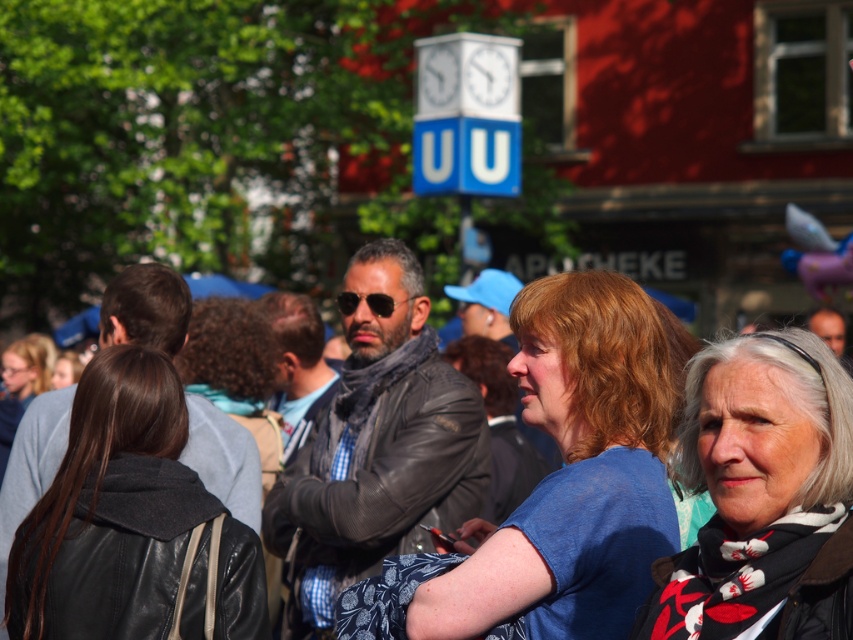
Is blue fabric shirt at center positioned before white printed scarf at center?

No, it is behind white printed scarf at center.

Measure the distance from blue fabric shirt at center to white printed scarf at center.

blue fabric shirt at center and white printed scarf at center are 3.52 feet apart from each other.

Describe the element at coordinates (560, 483) in the screenshot. I see `blue fabric shirt at center` at that location.

Locate an element on the screen. This screenshot has width=853, height=640. blue fabric shirt at center is located at coordinates (560, 483).

Does blue fabric shirt at center have a lesser width compared to leather jacket at center?

Incorrect, blue fabric shirt at center's width is not less than leather jacket at center's.

Does blue fabric shirt at center have a larger size compared to leather jacket at center?

Correct, blue fabric shirt at center is larger in size than leather jacket at center.

What do you see at coordinates (560, 483) in the screenshot?
I see `blue fabric shirt at center` at bounding box center [560, 483].

Locate an element on the screen. blue fabric shirt at center is located at coordinates (560, 483).

Is blue fabric shirt at center wider than black leather jacket at left?

Yes.

Is blue fabric shirt at center closer to camera compared to black leather jacket at left?

Yes, it is.

Which is in front, point (503, 540) or point (173, 541)?

Point (503, 540)

Where is `blue fabric shirt at center`? The width and height of the screenshot is (853, 640). blue fabric shirt at center is located at coordinates (560, 483).